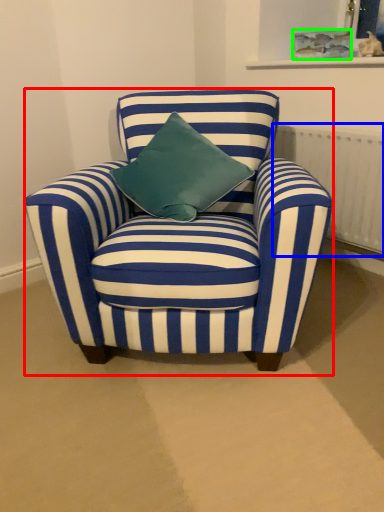
Question: Which object is positioned farthest from chair (highlighted by a red box)? Select from radiator (highlighted by a blue box) and picture frame (highlighted by a green box).

Choices:
 (A) radiator
 (B) picture frame

Answer: (B)